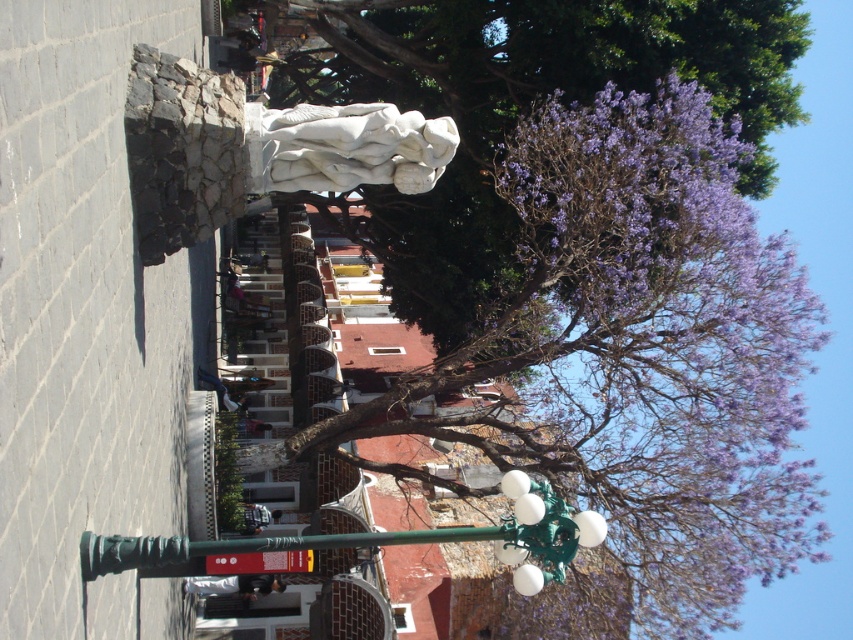
You are a city planner assessing the public square. You need to determine which object occupies more space in the scene. Which is larger between the purple leafy tree at upper center and the green painted metal streetlight at lower center?

The purple leafy tree at upper center is bigger than the green painted metal streetlight at lower center according to the description.

You are standing at the center of the plaza and want to find the green painted metal streetlight at lower center. According to the coordinates provided, in which direction relative to the center should you look to locate it?

→ The green painted metal streetlight at lower center is located at coordinates approximately 0.844 on the x axis and 0.457 on the y axis. Since the x coordinate is closer to 1, it is positioned to the right of the center, and the y coordinate is slightly above the center. Therefore, you should look to the right and slightly forward from the center to locate it.

You are an artist planning to sketch this scene. You want to ensure the purple leafy tree at upper center and the white marble statue at center are proportionally accurate. Which object should you draw larger in your sketch?

The purple leafy tree at upper center should be drawn larger than the white marble statue at center because it is described as having a larger size compared to the white marble statue at center.